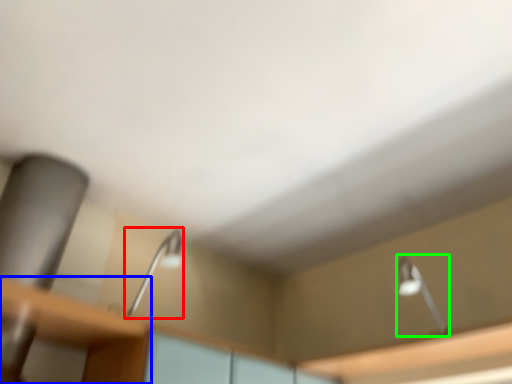
Question: Which is farther away from lamp (highlighted by a red box)? table (highlighted by a blue box) or lamp (highlighted by a green box)?

Choices:
 (A) table
 (B) lamp

Answer: (B)